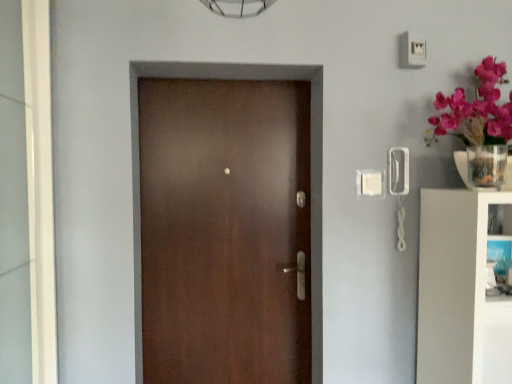
Question: Is clear glass vase at upper right inside or outside of satin brown door at center?

Choices:
 (A) outside
 (B) inside

Answer: (A)

Question: Considering the positions of clear glass vase at upper right and satin brown door at center in the image, is clear glass vase at upper right taller or shorter than satin brown door at center?

Choices:
 (A) tall
 (B) short

Answer: (B)

Question: Which object is positioned farthest from the white glossy bookshelf at right?

Choices:
 (A) white glossy glass door at left
 (B) satin brown door at center
 (C) clear glass vase at upper right

Answer: (A)

Question: Which object is the farthest from the clear glass vase at upper right?

Choices:
 (A) satin brown door at center
 (B) white glossy bookshelf at right
 (C) white glossy glass door at left

Answer: (C)